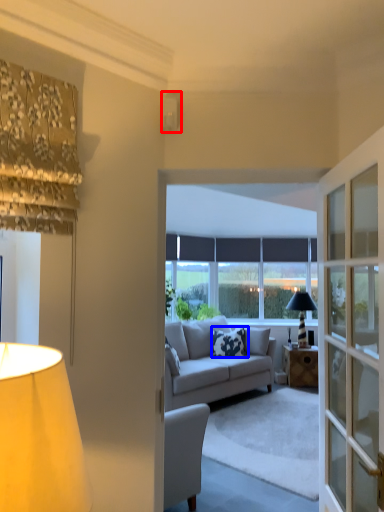
Question: Which object appears closest to the camera in this image, lamp (highlighted by a red box) or pillow (highlighted by a blue box)?

Choices:
 (A) lamp
 (B) pillow

Answer: (A)